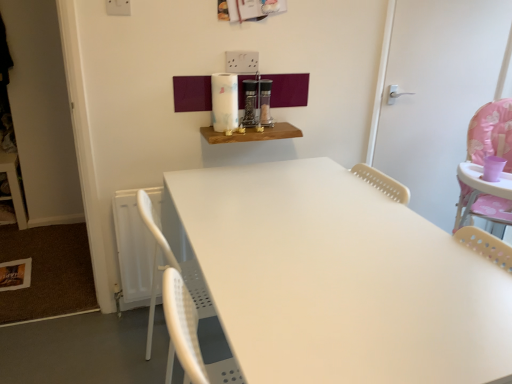
Question: Does white plastic door at right have a smaller size compared to wooden shelf at upper center?

Choices:
 (A) no
 (B) yes

Answer: (A)

Question: Is white plastic door at right bigger than wooden shelf at upper center?

Choices:
 (A) yes
 (B) no

Answer: (A)

Question: Can you confirm if white plastic door at right is shorter than wooden shelf at upper center?

Choices:
 (A) no
 (B) yes

Answer: (A)

Question: Is white plastic door at right directly adjacent to wooden shelf at upper center?

Choices:
 (A) yes
 (B) no

Answer: (B)

Question: Is wooden shelf at upper center located within white plastic door at right?

Choices:
 (A) yes
 (B) no

Answer: (B)

Question: Is white plastic door at right facing towards wooden shelf at upper center?

Choices:
 (A) yes
 (B) no

Answer: (B)

Question: Is white plastic door at right completely or partially inside wooden shelf at upper center?

Choices:
 (A) yes
 (B) no

Answer: (B)

Question: Would you consider wooden shelf at upper center to be distant from white plastic door at right?

Choices:
 (A) no
 (B) yes

Answer: (A)

Question: Can you confirm if wooden shelf at upper center is shorter than white plastic door at right?

Choices:
 (A) no
 (B) yes

Answer: (B)

Question: From a real-world perspective, is wooden shelf at upper center below white plastic door at right?

Choices:
 (A) no
 (B) yes

Answer: (B)

Question: From the image's perspective, would you say wooden shelf at upper center is shown under white plastic door at right?

Choices:
 (A) yes
 (B) no

Answer: (A)

Question: Is wooden shelf at upper center positioned in front of white plastic door at right?

Choices:
 (A) yes
 (B) no

Answer: (A)

Question: Considering the positions of wooden shelf at upper center and white plastic door at right in the image, is wooden shelf at upper center wider or thinner than white plastic door at right?

Choices:
 (A) wide
 (B) thin

Answer: (A)